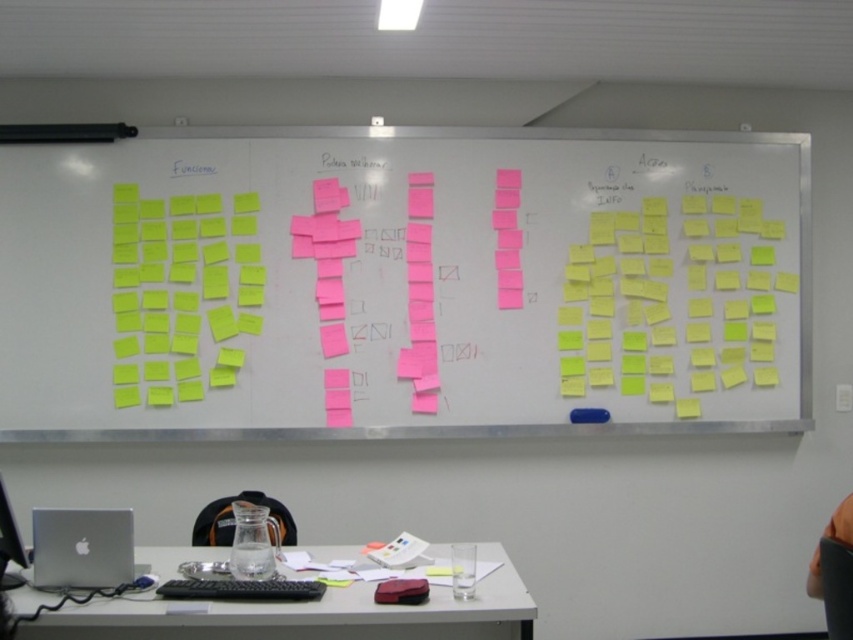
In the scene shown: You are organizing a meeting in the room with the whiteboard and desk. You need to place a large presentation binder on the desk. However, the yellow sticky notes at center are in the way. Can you move the white plastic table at lower center to make space?

The white plastic table at lower center is behind the yellow sticky notes at center, so moving the table would not directly clear space on the desk where the binder needs to be placed. The yellow sticky notes are likely on the whiteboard, so you should remove or rearrange them instead.

You are organizing a meeting and need to place a 12 inch by 12 inch poster on the desk. The poster must be placed between the yellow sticky notes at center and the silver metallic computer at lower left. Will the poster fit if it is placed in the space between them?

The yellow sticky notes at center is bigger than silver metallic computer at lower left. However, the question is about the space between them, not their sizes. The provided information does not specify the distance between the yellow sticky notes at center and the silver metallic computer at lower left, so we cannot determine if the poster will fit based on the given details.